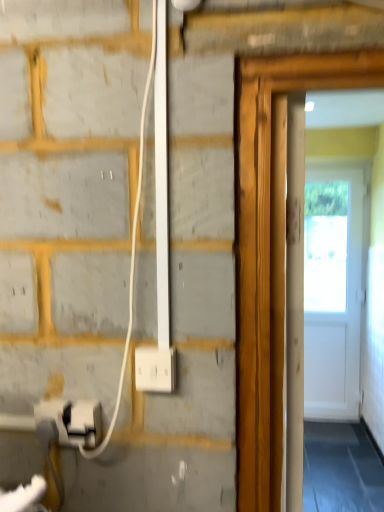
Question: Considering the relative positions of white plastic electric outlet at lower left and white plastic socket at lower center in the image provided, is white plastic electric outlet at lower left to the left of white plastic socket at lower center from the viewer's perspective?

Choices:
 (A) no
 (B) yes

Answer: (B)

Question: Does white plastic electric outlet at lower left touch white plastic socket at lower center?

Choices:
 (A) yes
 (B) no

Answer: (B)

Question: Is white plastic electric outlet at lower left further to camera compared to white plastic socket at lower center?

Choices:
 (A) no
 (B) yes

Answer: (B)

Question: From a real-world perspective, is white plastic electric outlet at lower left on white plastic socket at lower center?

Choices:
 (A) no
 (B) yes

Answer: (A)

Question: Is white plastic electric outlet at lower left not within white plastic socket at lower center?

Choices:
 (A) yes
 (B) no

Answer: (A)

Question: Is white plastic electric outlet at lower left facing away from white plastic socket at lower center?

Choices:
 (A) yes
 (B) no

Answer: (B)

Question: Is white plastic socket at lower center facing towards white plastic electric outlet at lower left?

Choices:
 (A) yes
 (B) no

Answer: (B)

Question: Does white plastic socket at lower center have a lesser height compared to white plastic electric outlet at lower left?

Choices:
 (A) yes
 (B) no

Answer: (B)

Question: Would you say white plastic socket at lower center is outside white plastic electric outlet at lower left?

Choices:
 (A) yes
 (B) no

Answer: (A)

Question: Does white plastic socket at lower center appear on the right side of white plastic electric outlet at lower left?

Choices:
 (A) yes
 (B) no

Answer: (A)

Question: From the image's perspective, does white plastic socket at lower center appear lower than white plastic electric outlet at lower left?

Choices:
 (A) yes
 (B) no

Answer: (B)

Question: Is white plastic socket at lower center beside white plastic electric outlet at lower left?

Choices:
 (A) yes
 (B) no

Answer: (B)

Question: Considering the positions of white plastic electric outlet at lower left and white plastic socket at lower center in the image, is white plastic electric outlet at lower left taller or shorter than white plastic socket at lower center?

Choices:
 (A) short
 (B) tall

Answer: (A)